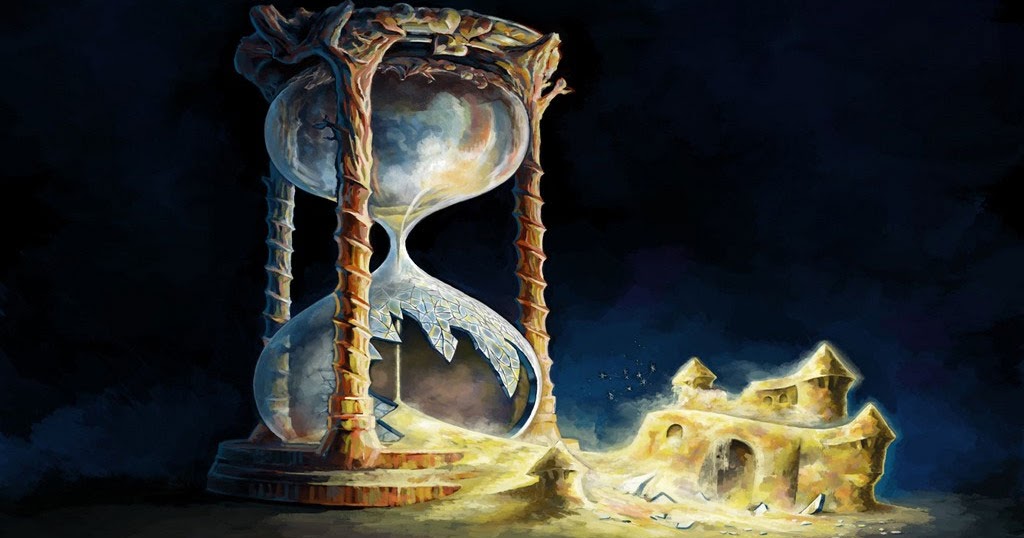
At what (x,y) coordinates should I click in order to perform the action: click on base of the hourglass. Please return your answer as a coordinate pair (x, y). Looking at the image, I should click on (387, 495).